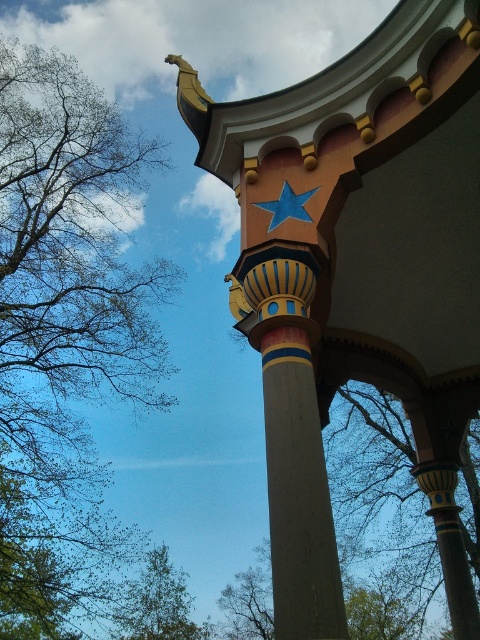
Question: Which object is positioned closest to the painted wood column at center?

Choices:
 (A) green leafy tree at left
 (B) blue matte star at upper center
 (C) green leafy tree at center

Answer: (B)

Question: Where is smooth concrete column at center located in relation to green leafy tree at lower left in the image?

Choices:
 (A) right
 (B) left

Answer: (A)

Question: Which object appears closest to the camera in this image?

Choices:
 (A) green leafy tree at center
 (B) blue matte star at upper center
 (C) smooth concrete column at center
 (D) painted wood column at center

Answer: (C)

Question: Among these points, which one is farthest from the camera?

Choices:
 (A) (262, 291)
 (B) (141, 620)
 (C) (478, 129)
 (D) (97, 145)

Answer: (D)

Question: In this image, where is painted wood column at center located relative to blue matte star at upper center?

Choices:
 (A) left
 (B) right

Answer: (B)

Question: Does painted wood column at center appear under smooth concrete column at center?

Choices:
 (A) yes
 (B) no

Answer: (A)